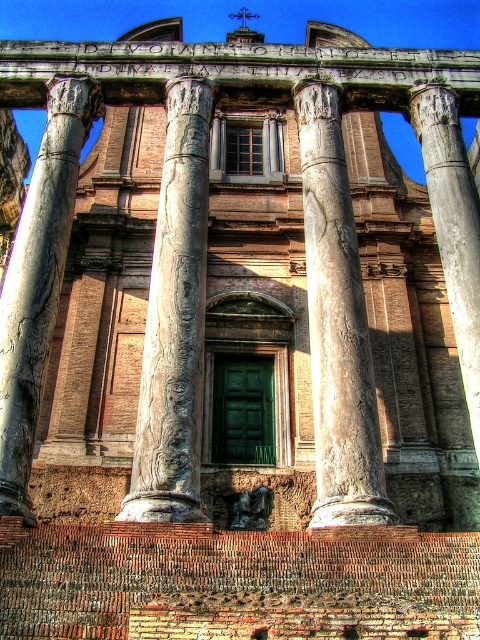
Which is more to the right, carved stone column at center or marble column at left?

Positioned to the right is carved stone column at center.

Locate an element on the screen. carved stone column at center is located at coordinates (175, 321).

Is carved stone column at center shorter than marble column at center?

No.

The width and height of the screenshot is (480, 640). Find the location of `carved stone column at center`. carved stone column at center is located at coordinates (175, 321).

Where is `carved stone column at center`? carved stone column at center is located at coordinates (175, 321).

Describe the element at coordinates (336, 324) in the screenshot. I see `marble column at center` at that location.

Is point (316, 93) positioned before point (436, 92)?

Yes, point (316, 93) is closer to viewer.

Image resolution: width=480 pixels, height=640 pixels. What do you see at coordinates (336, 324) in the screenshot? I see `marble column at center` at bounding box center [336, 324].

This screenshot has height=640, width=480. I want to click on marble column at center, so click(336, 324).